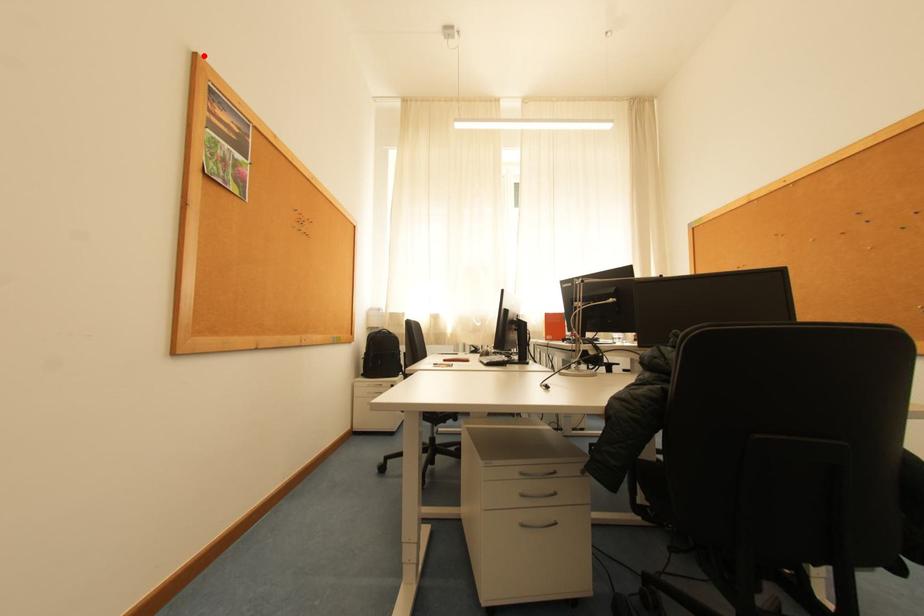
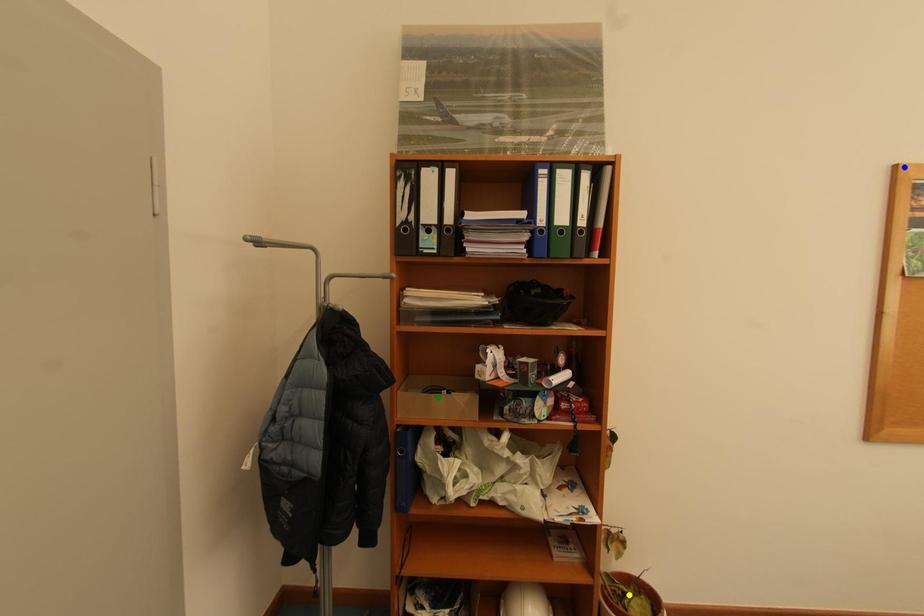
Question: I am providing you with two images of the same scene from different viewpoints. A red point is marked on the first image. You are given multiple points on the second image. Which spot in image 2 lines up with the point in image 1?

Choices:
 (A) green point
 (B) blue point
 (C) yellow point

Answer: (B)